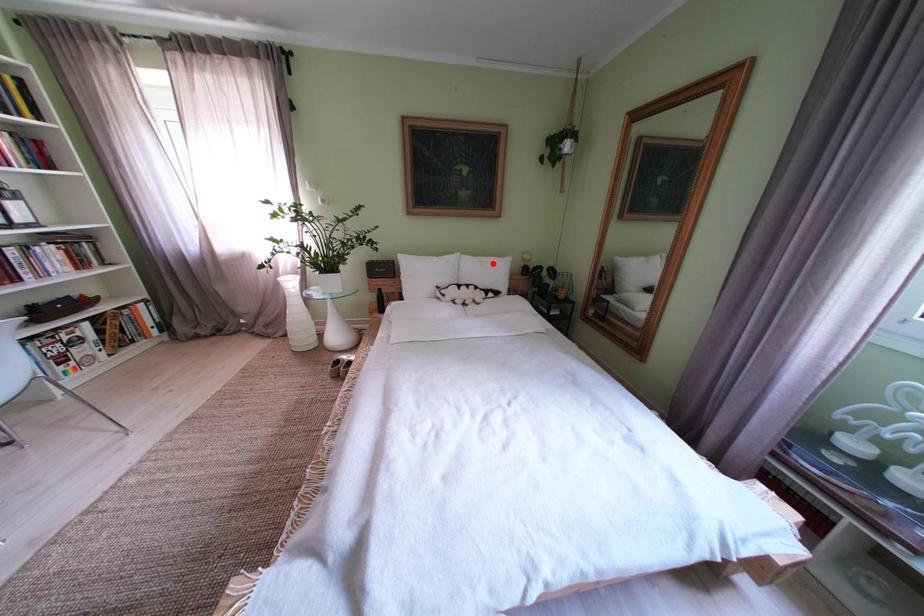
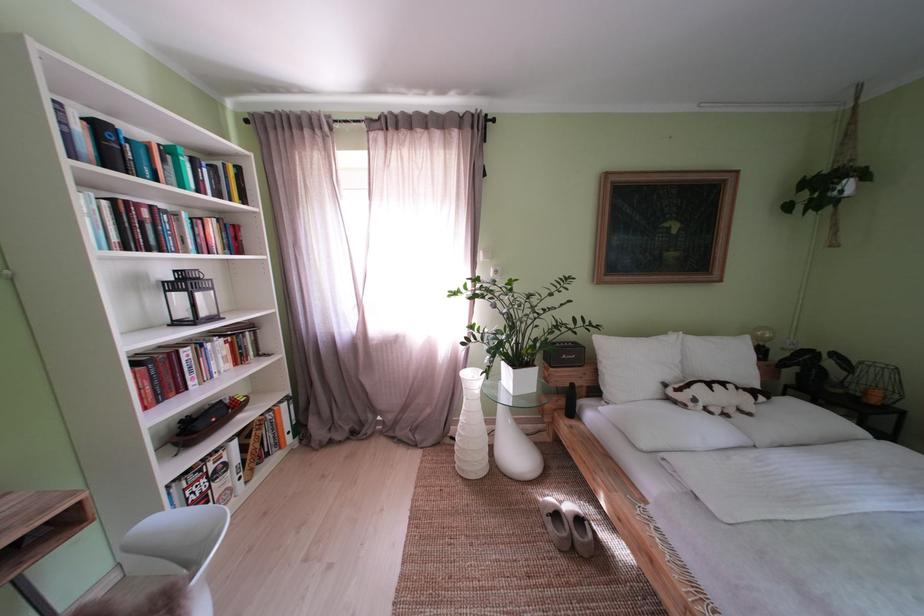
Question: I am providing you with two images of the same scene from different viewpoints. In image1, a red point is highlighted. Considering the same 3D point in image2, which of the following is correct?

Choices:
 (A) It is closer
 (B) It is farther

Answer: (B)